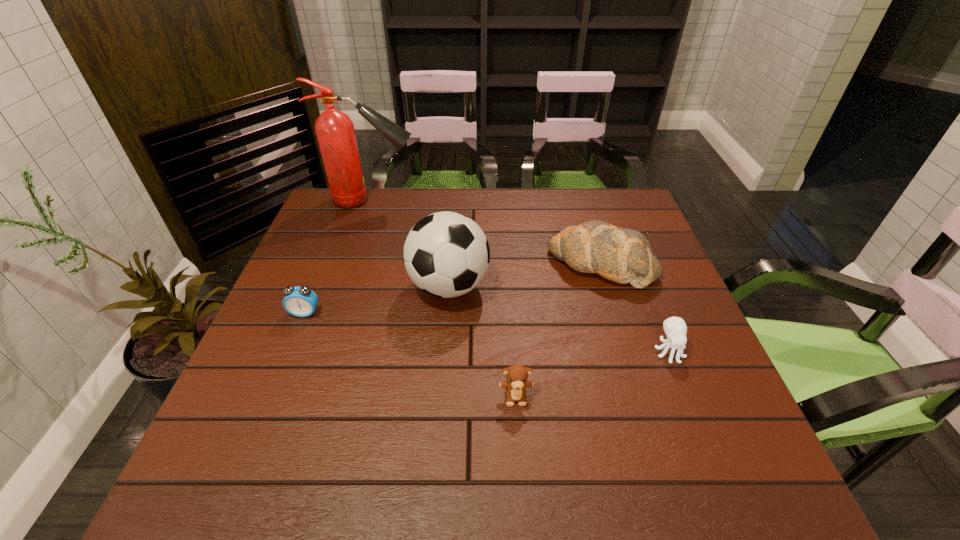
Locate an element on the screen. free space located 0.190m on the right of the fourth object from right to left is located at coordinates (563, 286).

Locate an element on the screen. The width and height of the screenshot is (960, 540). free location located on the front of the bread is located at coordinates (652, 423).

In order to click on vacant point located on the front-facing side of the octopus in this screenshot , I will do `click(724, 488)`.

This screenshot has width=960, height=540. Identify the location of free space located on the face of the alarm clock. pyautogui.click(x=271, y=398).

I want to click on vacant area situated on the face of the nearest object, so click(520, 461).

At what (x,y) coordinates should I click in order to perform the action: click on object present at the far edge. Please return your answer as a coordinate pair (x, y). The height and width of the screenshot is (540, 960). Looking at the image, I should click on (335, 133).

Where is `fire extinguisher positioned at the left edge`? fire extinguisher positioned at the left edge is located at coordinates (335, 133).

Locate an element on the screen. Image resolution: width=960 pixels, height=540 pixels. alarm clock at the left edge is located at coordinates (301, 301).

I want to click on bread that is at the right edge, so click(622, 255).

This screenshot has width=960, height=540. What are the coordinates of `octopus present at the right edge` in the screenshot? It's located at 675,328.